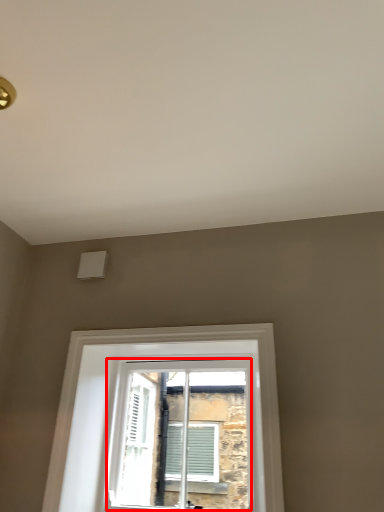
Question: From the image, what is the correct spatial relationship of window (annotated by the red box) in relation to window?

Choices:
 (A) right
 (B) left

Answer: (A)